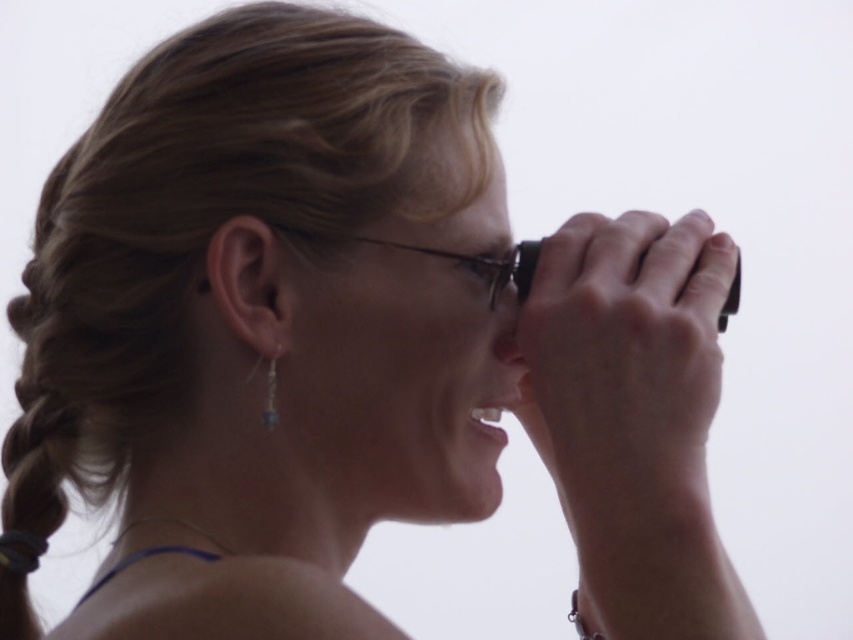
Question: Can you confirm if clear glass eye at center is bigger than silver metallic earring at lower left?

Choices:
 (A) yes
 (B) no

Answer: (A)

Question: Is clear glass eye at center to the left of silver metallic earring at lower left from the viewer's perspective?

Choices:
 (A) yes
 (B) no

Answer: (B)

Question: Which of the following is the closest to the observer?

Choices:
 (A) (483, 275)
 (B) (273, 416)

Answer: (B)

Question: Can you confirm if clear glass eye at center is smaller than silver metallic earring at lower left?

Choices:
 (A) no
 (B) yes

Answer: (A)